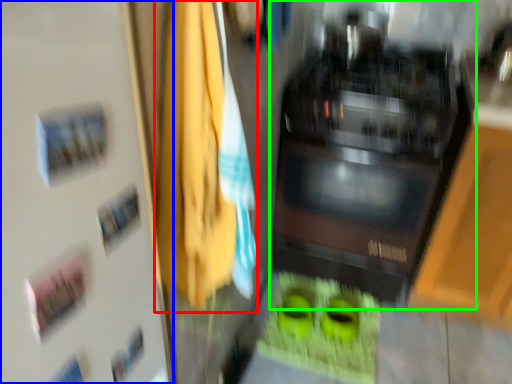
Question: Based on their relative distances, which object is nearer to laundry (highlighted by a red box)? Choose from door (highlighted by a blue box) and home appliance (highlighted by a green box).

Choices:
 (A) door
 (B) home appliance

Answer: (A)